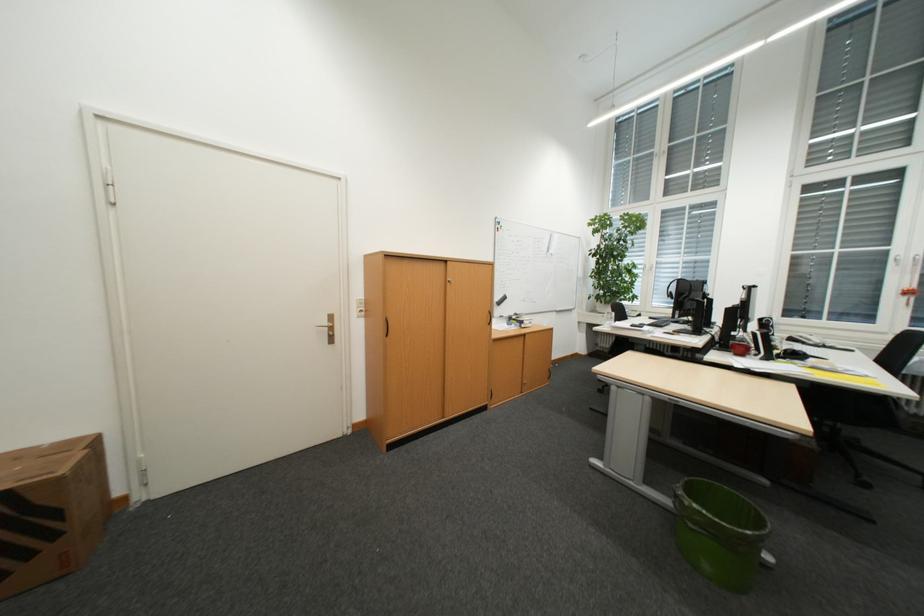
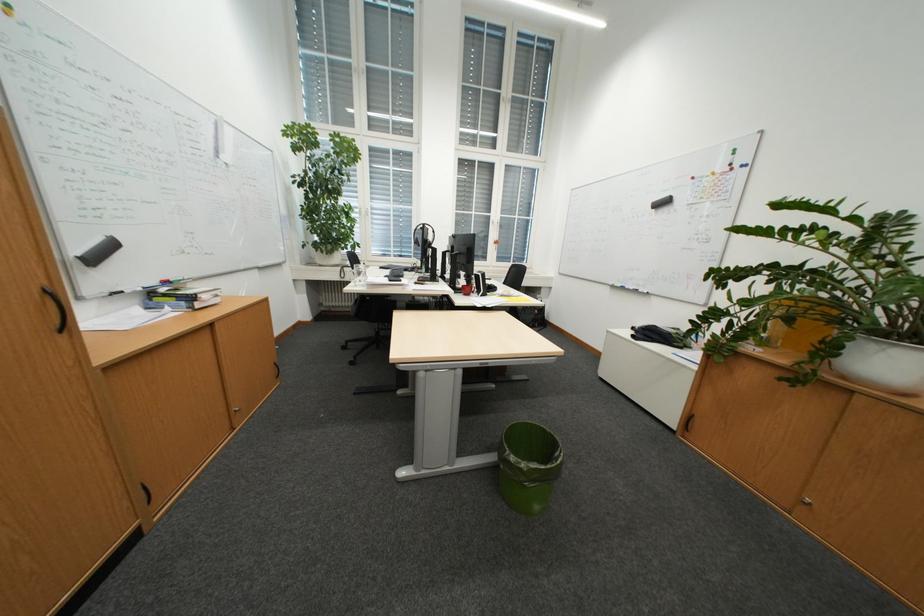
Question: Based on the continuous images, in which direction is the camera rotating? Reply with the corresponding letter.

Choices:
 (A) Left
 (B) Right
 (C) Up
 (D) Down

Answer: (B)